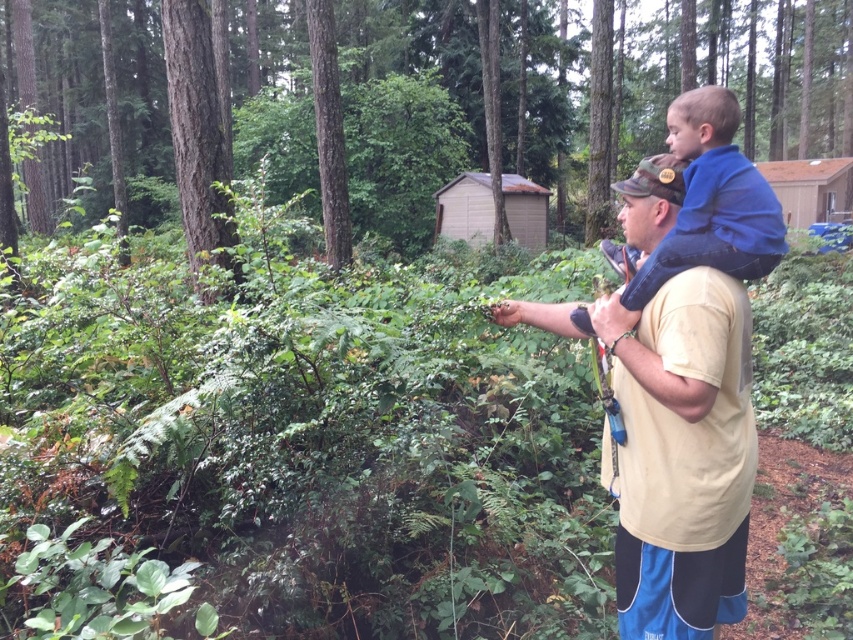
You are a hiker lost in the forest. You see a tan cotton shirt at center and a blue fleece at upper right. Which clothing item is closer to you?

The tan cotton shirt at center is closer to you because the blue fleece at upper right is behind it.

You are a hiker in the forest and see a tan cotton shirt at center and a blue fleece at upper right. Which clothing item is closer to the ground?

The tan cotton shirt at center is closer to the ground because it is below the blue fleece at upper right.

You are standing at the point marked as point [724,435] in the forest. You need to take a photo of the camera located 6.37 feet away from you. Is the camera within your reach to adjust it before taking the photo?

The camera is 6.37 feet away from point [724,435], so it is within reach to adjust before taking the photo.